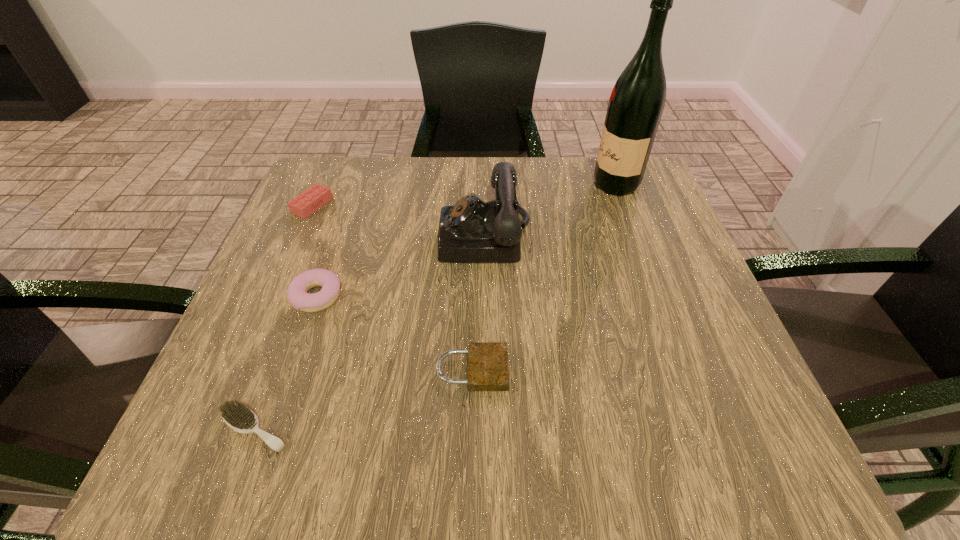
Locate an element on the screen. The height and width of the screenshot is (540, 960). free space located on the dial of the telephone is located at coordinates (368, 238).

What are the coordinates of `free spot located 0.290m on the dial of the telephone` in the screenshot? It's located at (300, 238).

Locate an element on the screen. Image resolution: width=960 pixels, height=540 pixels. blank area located 0.190m on the dial of the telephone is located at coordinates (348, 238).

Find the location of a particular element. The height and width of the screenshot is (540, 960). free location located on the right of the doughnut is located at coordinates [540, 297].

At what (x,y) coordinates should I click in order to perform the action: click on vacant area located on the right of the fourth tallest object. Please return your answer as a coordinate pair (x, y). This screenshot has width=960, height=540. Looking at the image, I should click on (490, 205).

I want to click on vacant region located on the keyhole side of the padlock, so click(x=646, y=370).

The image size is (960, 540). Identify the location of free space located on the back of the scrubbing brush. (293, 326).

This screenshot has width=960, height=540. In order to click on liquor located in the far edge section of the desktop in this screenshot , I will do `click(636, 104)`.

This screenshot has height=540, width=960. Identify the location of telephone that is at the far edge. point(472,231).

Find the location of a particular element. Image resolution: width=960 pixels, height=540 pixels. Lego located in the far edge section of the desktop is located at coordinates (306, 203).